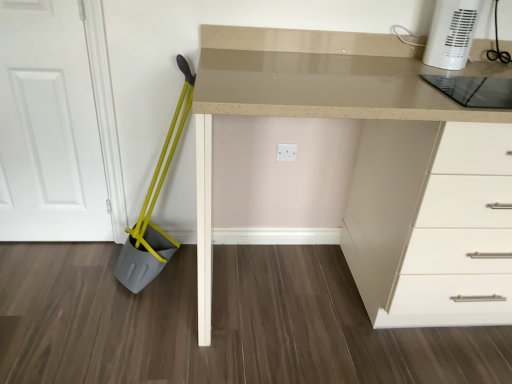
Question: Considering the positions of transparent glass cutting board at upper right and white plastic heater at upper right in the image, is transparent glass cutting board at upper right taller or shorter than white plastic heater at upper right?

Choices:
 (A) short
 (B) tall

Answer: (A)

Question: Is transparent glass cutting board at upper right spatially inside white plastic heater at upper right, or outside of it?

Choices:
 (A) outside
 (B) inside

Answer: (A)

Question: Based on their relative distances, which object is farther from the white matte door at left?

Choices:
 (A) matte beige desk at center
 (B) yellow plastic shovel at left
 (C) transparent glass cutting board at upper right
 (D) white plastic heater at upper right

Answer: (D)

Question: Which of these objects is positioned closest to the matte beige desk at center?

Choices:
 (A) white plastic heater at upper right
 (B) yellow plastic shovel at left
 (C) white matte door at left
 (D) transparent glass cutting board at upper right

Answer: (D)